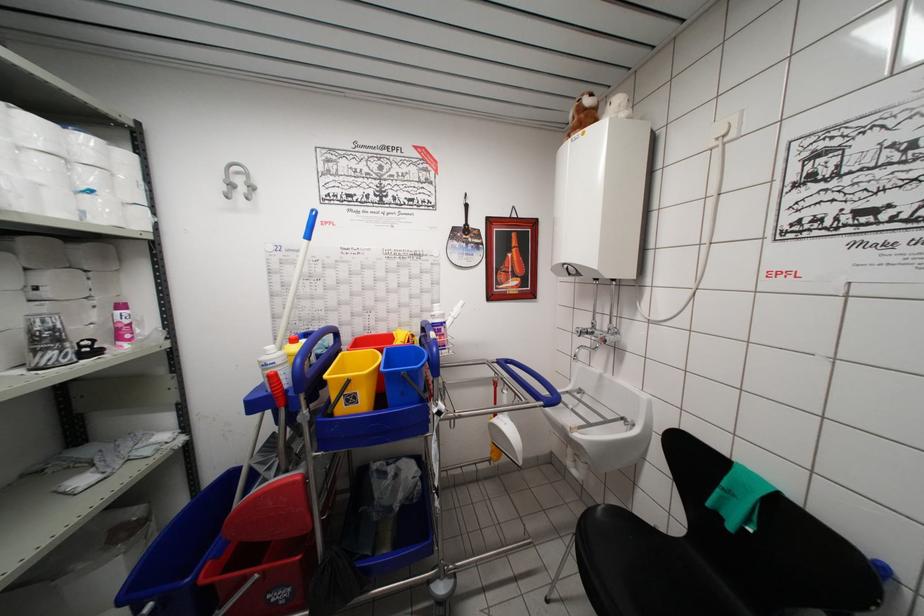
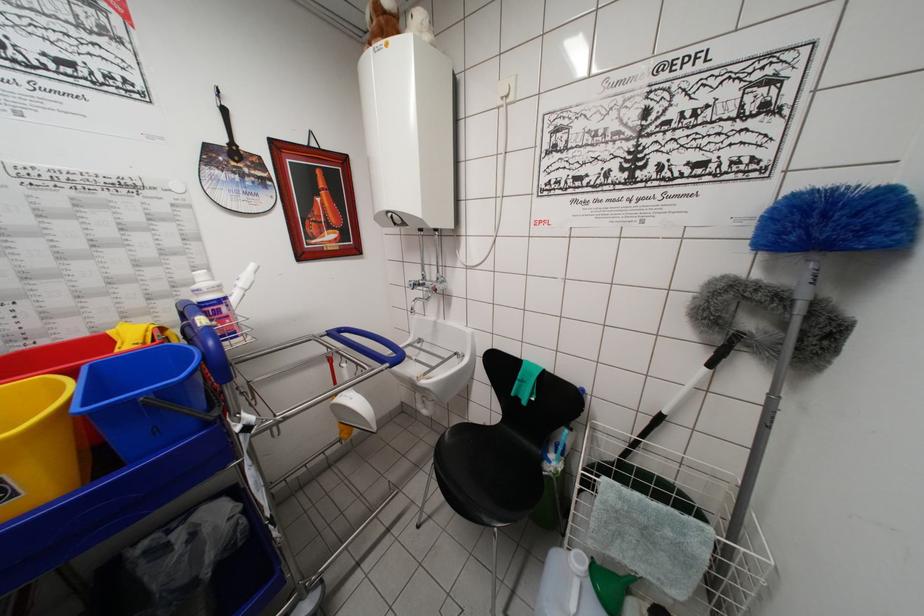
The point at (589, 114) is marked in the first image. Where is the corresponding point in the second image?

(387, 17)